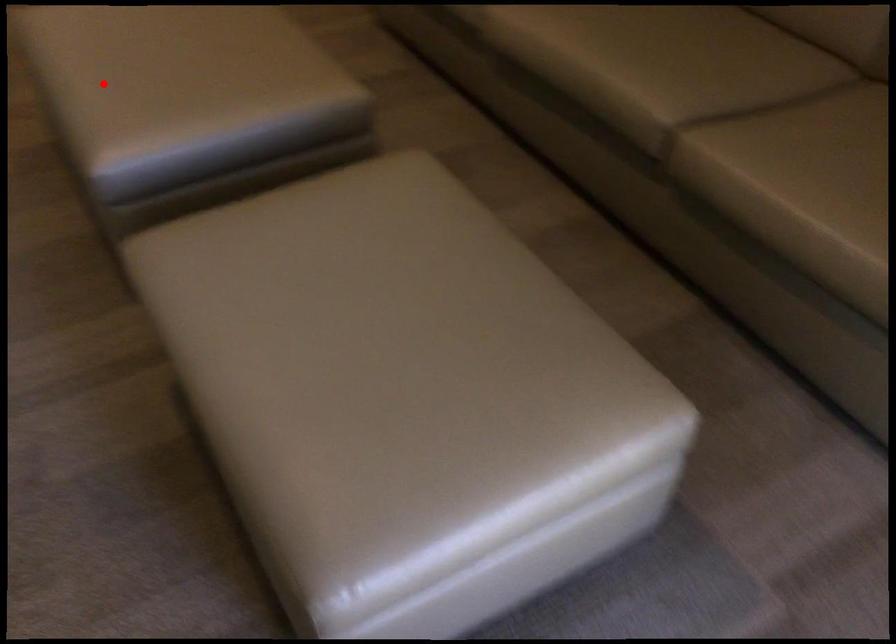
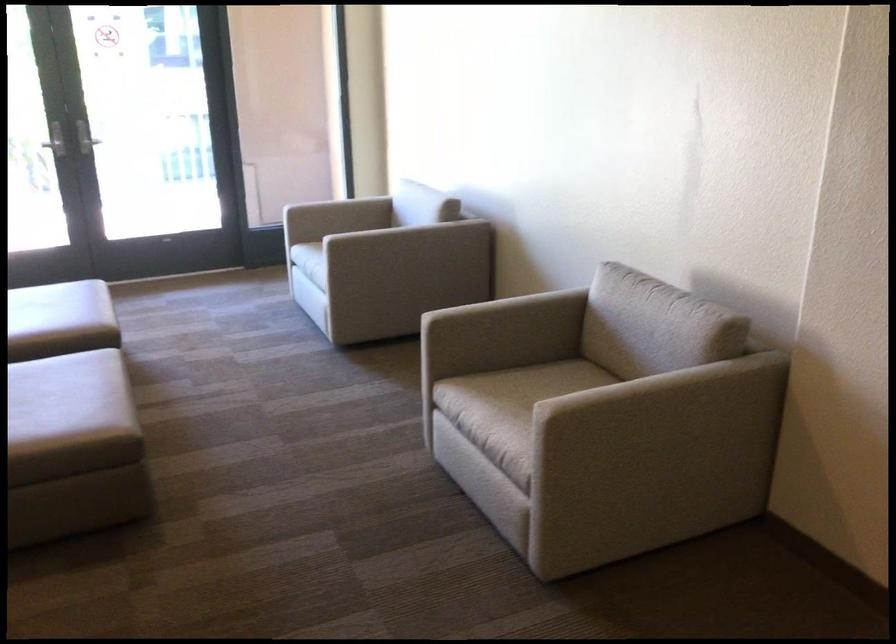
Where in the second image is the point corresponding to the highlighted location from the first image?

(65, 384)